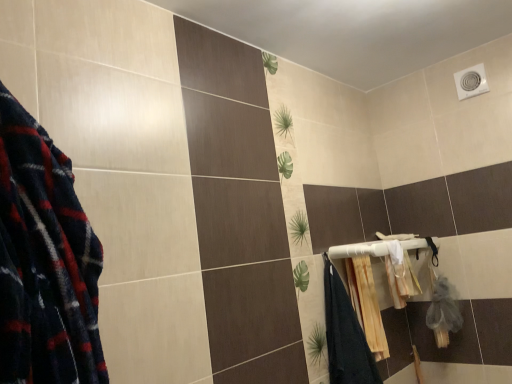
Question: Is beige textured towel at lower right, acting as the first bath towel starting from the left, further to the viewer compared to white plastic towel bar at upper right?

Choices:
 (A) no
 (B) yes

Answer: (B)

Question: Considering the relative sizes of beige textured towel at lower right, acting as the first bath towel starting from the left, and white plastic towel bar at upper right in the image provided, is beige textured towel at lower right, acting as the first bath towel starting from the left, shorter than white plastic towel bar at upper right?

Choices:
 (A) yes
 (B) no

Answer: (B)

Question: Considering the relative sizes of beige textured towel at lower right, acting as the first bath towel starting from the left, and white plastic towel bar at upper right in the image provided, is beige textured towel at lower right, acting as the first bath towel starting from the left, smaller than white plastic towel bar at upper right?

Choices:
 (A) no
 (B) yes

Answer: (B)

Question: Is beige textured towel at lower right, which is the second bath towel in right-to-left order, at the left side of white plastic towel bar at upper right?

Choices:
 (A) yes
 (B) no

Answer: (A)

Question: Considering the relative sizes of beige textured towel at lower right, acting as the first bath towel starting from the left, and white plastic towel bar at upper right in the image provided, is beige textured towel at lower right, acting as the first bath towel starting from the left, wider than white plastic towel bar at upper right?

Choices:
 (A) no
 (B) yes

Answer: (A)

Question: From the image's perspective, is beige textured towel at lower right, which is the second bath towel in right-to-left order, positioned above or below white plastic towel bar at upper right?

Choices:
 (A) above
 (B) below

Answer: (B)

Question: From a real-world perspective, is beige textured towel at lower right, acting as the first bath towel starting from the left, physically located above or below white plastic towel bar at upper right?

Choices:
 (A) below
 (B) above

Answer: (A)

Question: Would you say beige textured towel at lower right, which is the second bath towel in right-to-left order, is to the left or to the right of white plastic towel bar at upper right in the picture?

Choices:
 (A) right
 (B) left

Answer: (B)

Question: Choose the correct answer: Is beige textured towel at lower right, which is the second bath towel in right-to-left order, inside white plastic towel bar at upper right or outside it?

Choices:
 (A) inside
 (B) outside

Answer: (B)

Question: Is white plastic towel bar at upper right inside the boundaries of beige textured towel at lower right, acting as the first bath towel starting from the left, or outside?

Choices:
 (A) inside
 (B) outside

Answer: (B)

Question: In terms of size, does white plastic towel bar at upper right appear bigger or smaller than beige textured towel at lower right, acting as the first bath towel starting from the left?

Choices:
 (A) big
 (B) small

Answer: (A)

Question: From the image's perspective, is white plastic towel bar at upper right positioned above or below beige textured towel at lower right, which is the second bath towel in right-to-left order?

Choices:
 (A) above
 (B) below

Answer: (A)

Question: Is point (411, 241) positioned closer to the camera than point (385, 352)?

Choices:
 (A) farther
 (B) closer

Answer: (A)

Question: Is white plastic towel bar at upper right inside the boundaries of white fabric bath towel at lower right, which is counted as the 1th bath towel, starting from the right, or outside?

Choices:
 (A) outside
 (B) inside

Answer: (A)

Question: Considering the relative positions of white plastic towel bar at upper right and white fabric bath towel at lower right, placed as the 2th bath towel when sorted from left to right, in the image provided, is white plastic towel bar at upper right to the left or to the right of white fabric bath towel at lower right, placed as the 2th bath towel when sorted from left to right,?

Choices:
 (A) left
 (B) right

Answer: (A)